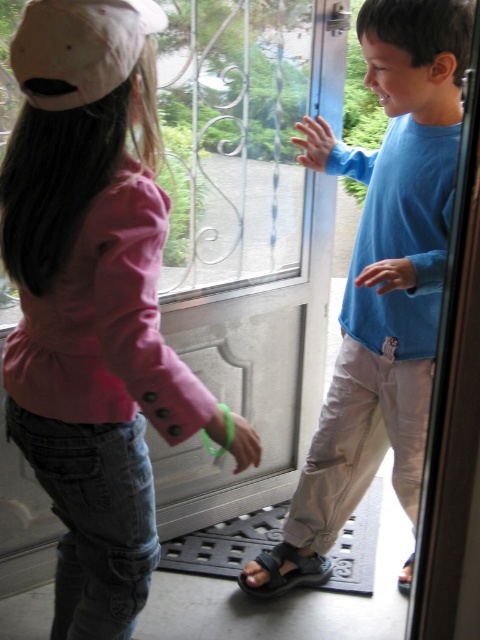
Question: Which object is farther from the camera taking this photo?

Choices:
 (A) blue cotton shirt at center
 (B) white matte baseball cap at upper left
 (C) pink fabric jacket at left

Answer: (A)

Question: Which point appears farthest from the camera in this image?

Choices:
 (A) (427, 96)
 (B) (286, 564)
 (C) (130, 584)
 (D) (120, 8)

Answer: (B)

Question: Among these points, which one is nearest to the camera?

Choices:
 (A) pos(87,579)
 (B) pos(303,577)
 (C) pos(117,16)

Answer: (C)

Question: Is white matte baseball cap at upper left positioned at the back of black leather sandal at lower center?

Choices:
 (A) no
 (B) yes

Answer: (A)

Question: Is pink fabric jacket at left below white matte baseball cap at upper left?

Choices:
 (A) no
 (B) yes

Answer: (B)

Question: Is pink fabric jacket at left positioned in front of black rubber sandal at lower center?

Choices:
 (A) no
 (B) yes

Answer: (B)